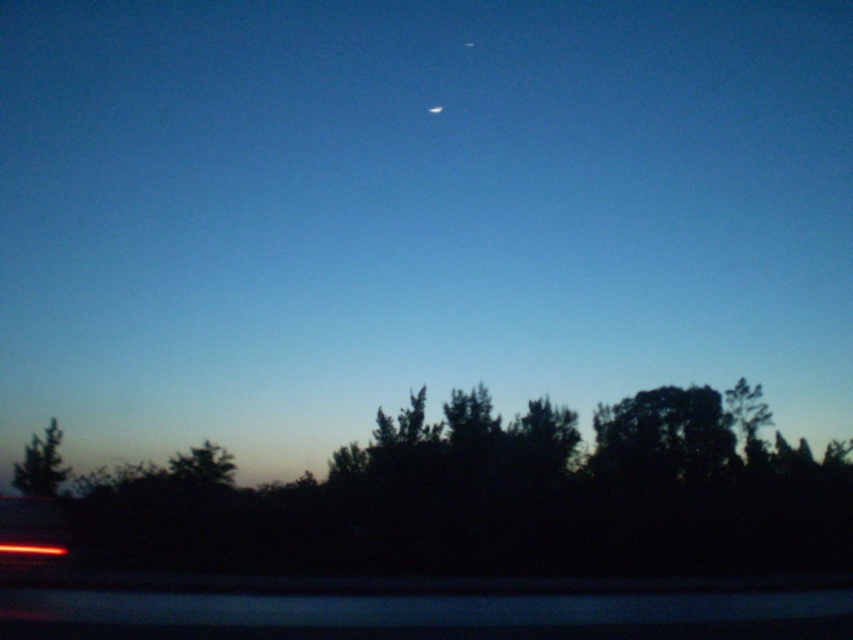
You are an astronomer observing the twilight scene. You notice the silhouette leafy tree at lower center and the white glossy moon at upper center. Which object appears closer to you in the image?

The silhouette leafy tree at lower center appears closer to you because it is positioned in front of the white glossy moon at upper center.

You are an astronomer observing the twilight scene. You notice the green matte tree at lower left and the white glossy moon at upper center. Which object is closer to you from your observation point?

The green matte tree at lower left is closer to you because it is in front of the white glossy moon at upper center, indicating it is positioned nearer in the visual plane.